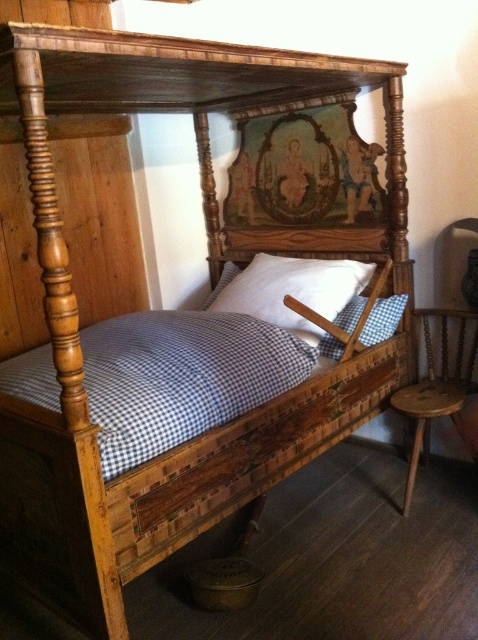
You are standing in a room with a rustic wooden bed. There is a point at coordinates (293,291). What object is located at this point?

The point at coordinates (293,291) is on the white matte pillow at center.

You are arranging pillows on the bed and see the white matte pillow at center and the white checkered pillow at center. Which one is placed on top of the other?

The white matte pillow at center is positioned over the white checkered pillow at center, so it is on top.